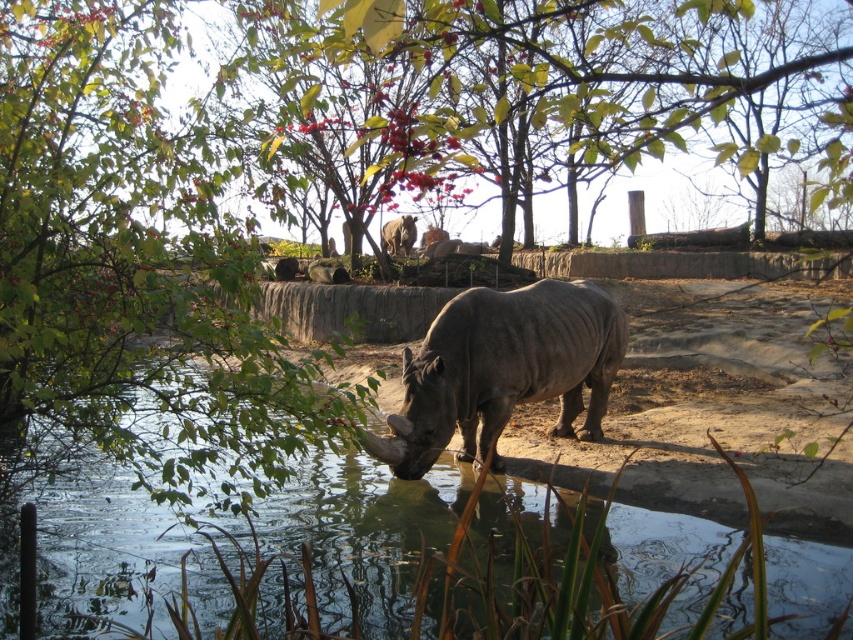
You are a zookeeper who needs to measure the distance between the transparent water at center and the gray matte rhinoceros at center. Can you confirm if the distance is more than 4 meters?

The transparent water at center is 4.82 meters away from the gray matte rhinoceros at center, so yes, the distance is more than 4 meters.

You are standing at the origin point of the coordinate system in this image. The gray matte rhinoceros at center is located at point (x=502, y=371). If you want to move towards the rhinoceros, in which direction should you move?

The gray matte rhinoceros at center is located at point (x=502, y=371), so you should move towards the center of the image to reach it.

You are a zookeeper observing the gray matte rhinoceros at center and the transparent water at center. Which object is located more to the left in the scene?

The transparent water at center is positioned on the left side of gray matte rhinoceros at center, so it is more to the left.